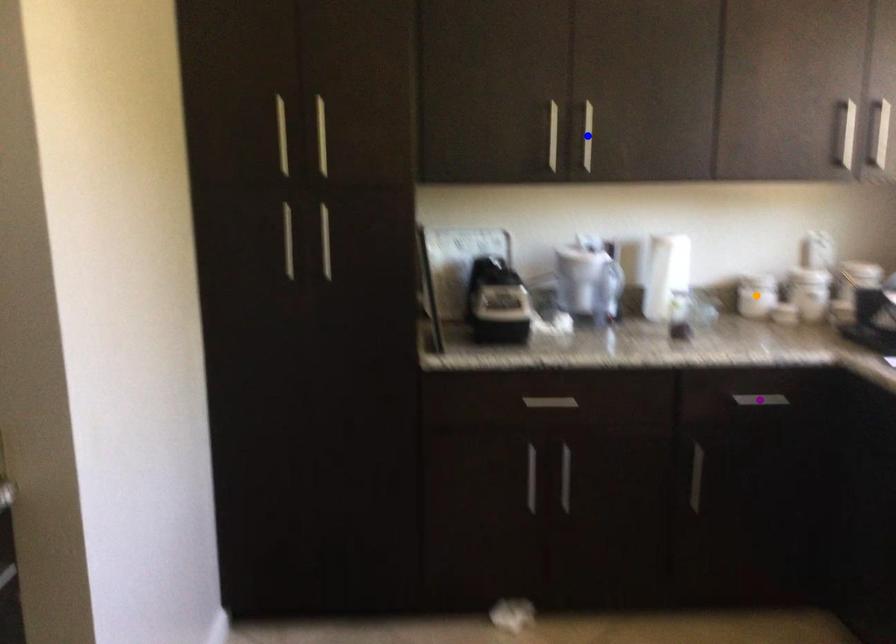
Order these from farthest to nearest:
blue point | purple point | orange point

1. orange point
2. blue point
3. purple point